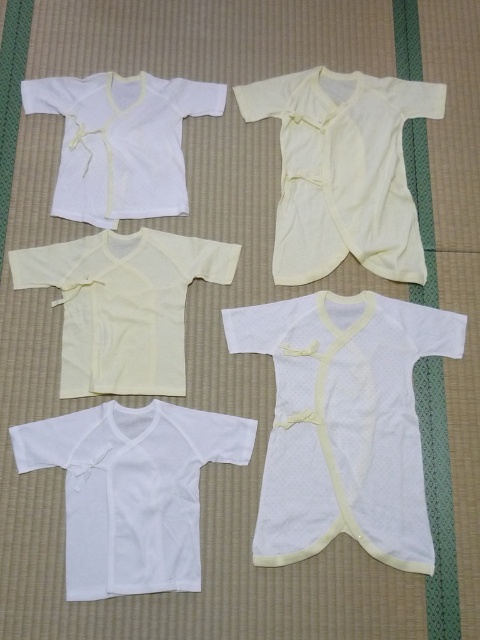
Question: Is creamy yellow knit onesie at upper center thinner than white cotton shirt at upper left?

Choices:
 (A) yes
 (B) no

Answer: (B)

Question: Is creamy yellow knit onesie at upper center smaller than yellow soft cotton shirt at center?

Choices:
 (A) yes
 (B) no

Answer: (B)

Question: Estimate the real-world distances between objects in this image. Which object is farther from the creamy yellow knit onesie at upper center?

Choices:
 (A) white cotton shirt at upper left
 (B) yellow soft cotton shirt at center
 (C) white matte t-shirt at lower left

Answer: (C)

Question: Which of the following is the closest to the observer?

Choices:
 (A) (71, 356)
 (B) (69, 212)
 (C) (374, 355)

Answer: (C)

Question: Can you confirm if white soft fabric baby gown at center is positioned to the right of yellow soft cotton shirt at center?

Choices:
 (A) no
 (B) yes

Answer: (B)

Question: Which object is closer to the camera taking this photo?

Choices:
 (A) white soft fabric baby gown at center
 (B) white matte t-shirt at lower left
 (C) yellow soft cotton shirt at center

Answer: (B)